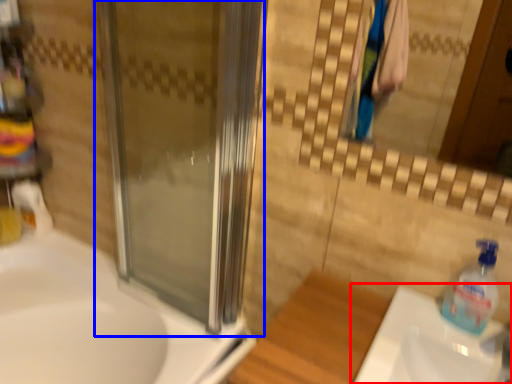
Question: Among these objects, which one is farthest to the camera, sink (highlighted by a red box) or screen door (highlighted by a blue box)?

Choices:
 (A) sink
 (B) screen door

Answer: (B)